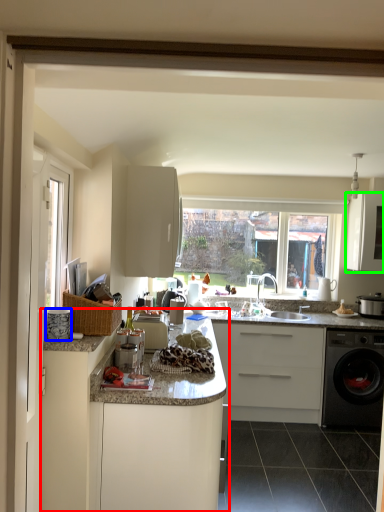
Question: Considering the real-world distances, which object is farthest from cabinetry (highlighted by a red box)? appliance (highlighted by a blue box) or cabinetry (highlighted by a green box)?

Choices:
 (A) appliance
 (B) cabinetry

Answer: (B)